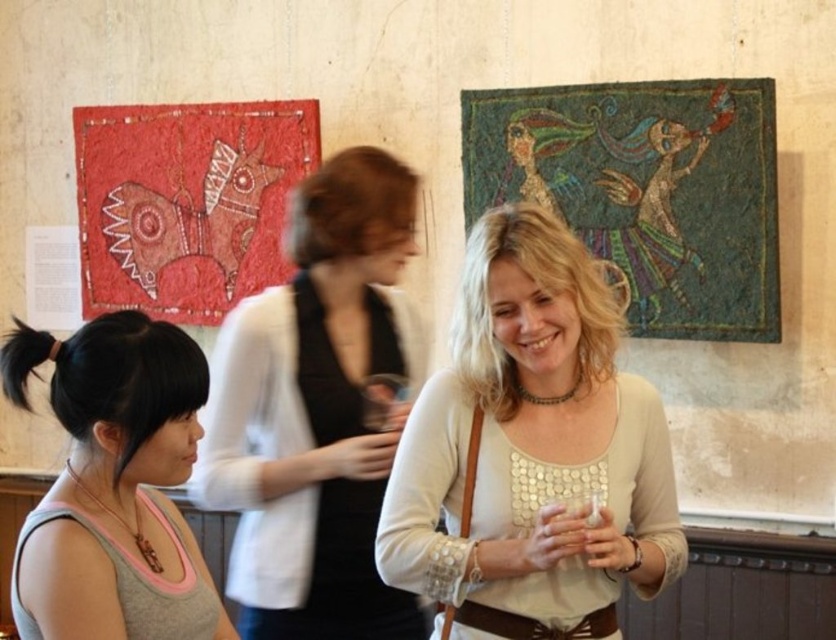
Question: Which of the following is the farthest from the observer?

Choices:
 (A) (x=488, y=621)
 (B) (x=283, y=433)

Answer: (B)

Question: Estimate the real-world distances between objects in this image. Which object is closer to the light beige sweater at center?

Choices:
 (A) red fabric quilt at left
 (B) textured mosaic at upper right

Answer: (B)

Question: Does white matte sweater at center come in front of gray fabric tank top at lower left?

Choices:
 (A) yes
 (B) no

Answer: (B)

Question: Is light beige sweater at center to the right of textured mosaic at upper right from the viewer's perspective?

Choices:
 (A) yes
 (B) no

Answer: (B)

Question: Is white matte sweater at center positioned behind gray fabric tank top at lower left?

Choices:
 (A) yes
 (B) no

Answer: (A)

Question: Estimate the real-world distances between objects in this image. Which object is farther from the gray fabric tank top at lower left?

Choices:
 (A) red fabric quilt at left
 (B) white matte sweater at center
 (C) light beige sweater at center
 (D) textured mosaic at upper right

Answer: (A)